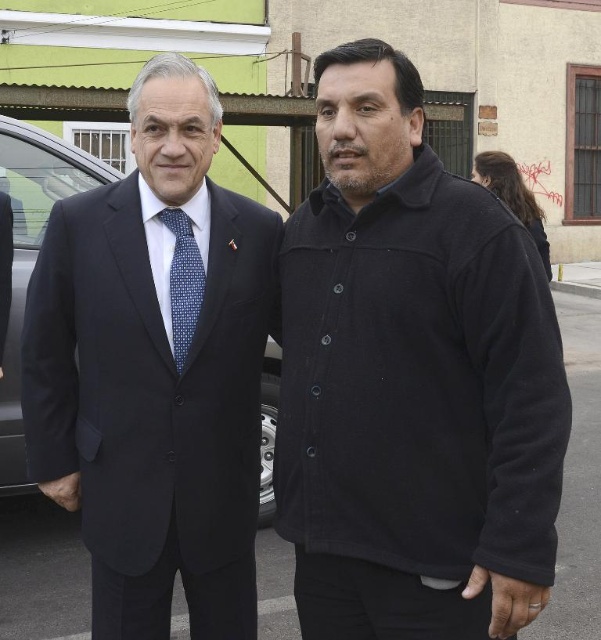
Question: Estimate the real-world distances between objects in this image. Which object is farther from the blue dotted tie at center?

Choices:
 (A) black fleece jacket at center
 (B) dark blue fabric car at left
 (C) matte black suit at left

Answer: (B)

Question: From the image, what is the correct spatial relationship of matte black suit at left in relation to dark blue fabric car at left?

Choices:
 (A) below
 (B) above

Answer: (A)

Question: Can you confirm if black fleece jacket at center is positioned to the right of blue dotted tie at center?

Choices:
 (A) no
 (B) yes

Answer: (B)

Question: Which of the following is the closest to the observer?

Choices:
 (A) black fleece jacket at center
 (B) dark blue fabric car at left
 (C) blue dotted tie at center
 (D) matte black suit at left

Answer: (A)

Question: Does black fleece jacket at center appear under blue dotted tie at center?

Choices:
 (A) yes
 (B) no

Answer: (A)

Question: Which object appears farthest from the camera in this image?

Choices:
 (A) blue dotted tie at center
 (B) matte black suit at left
 (C) dark blue fabric car at left
 (D) black fleece jacket at center

Answer: (C)